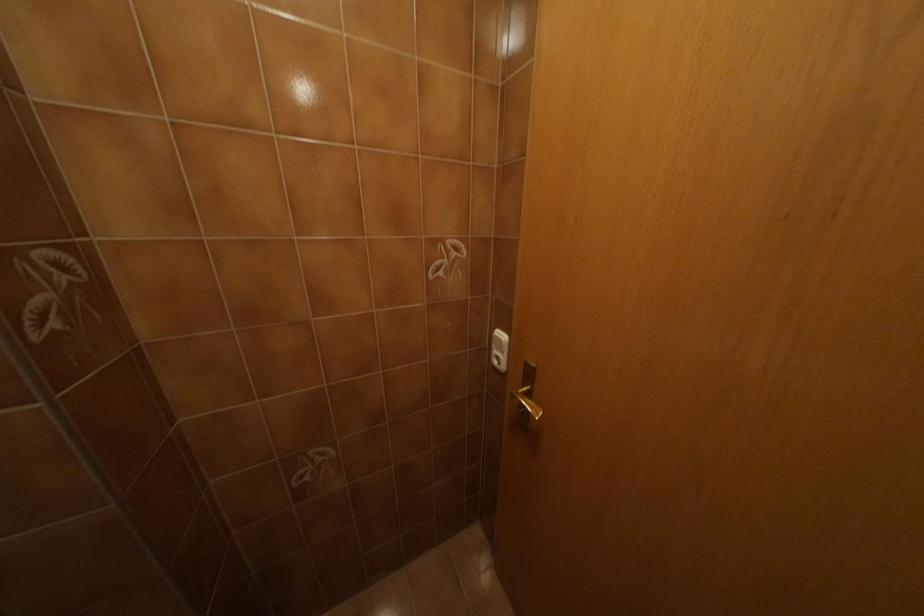
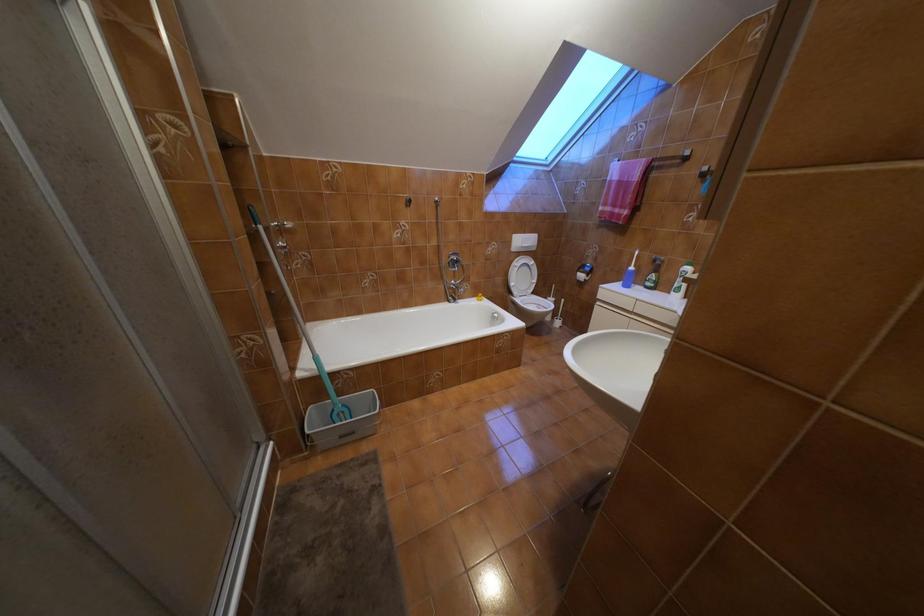
How did the camera likely rotate?

The camera's rotation is toward left-down.